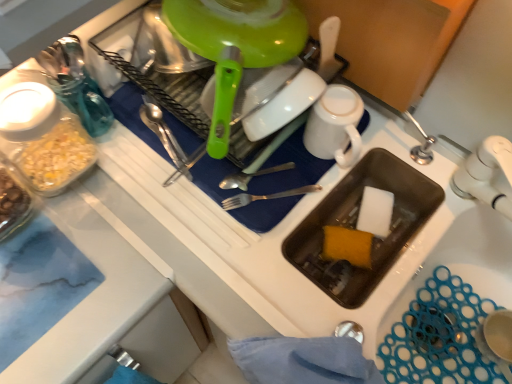
I want to click on free space in front of green plastic kettle at upper center, so click(x=227, y=257).